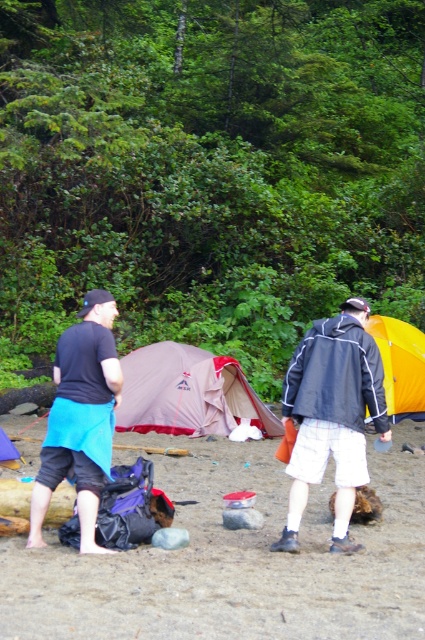
Question: Does brown sandy beach at lower center appear under yellow fabric tent at right?

Choices:
 (A) no
 (B) yes

Answer: (B)

Question: Which point appears farthest from the camera in this image?

Choices:
 (A) (163, 637)
 (B) (2, 435)

Answer: (B)

Question: Based on their relative distances, which object is nearer to the matte gray tent at center?

Choices:
 (A) blue fabric shorts at lower left
 (B) matte pink tent at center
 (C) yellow fabric tent at right

Answer: (C)

Question: Is blue fabric shorts at lower left positioned behind yellow fabric tent at right?

Choices:
 (A) yes
 (B) no

Answer: (B)

Question: Which object is positioned farthest from the yellow fabric tent at right?

Choices:
 (A) blue fabric shorts at lower left
 (B) brown sandy beach at lower center
 (C) dark gray jacket at center
 (D) matte gray tent at center

Answer: (B)

Question: Considering the relative positions of brown sandy beach at lower center and blue fabric shorts at lower left in the image provided, where is brown sandy beach at lower center located with respect to blue fabric shorts at lower left?

Choices:
 (A) below
 (B) above

Answer: (A)